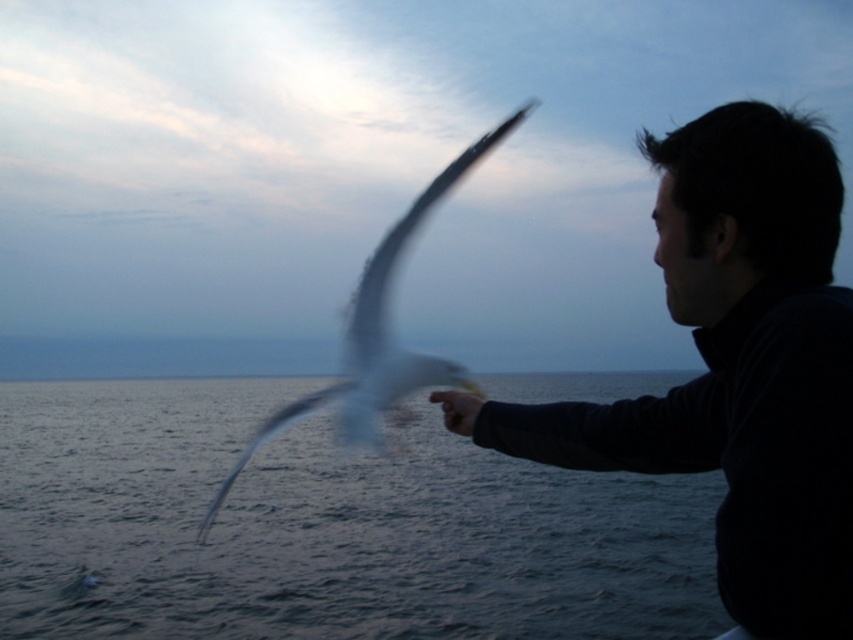
Consider the image. You are an observer standing on the dock looking at the black matte fish at right and the white feathered bird at center. Which object is positioned more to the right side of the scene?

The white feathered bird at center is positioned more to the right side of the scene because the black matte fish at right is to the left of it.

You are navigating a small boat in the twilight scene and need to drop an anchor. The coordinates for two potential anchor points are given as point (160,532) and point (379,433). According to the image, which point is closer to the person depicted in the scene?

Point (379,433) is closer to the person because point (160,532) is behind point (379,433), indicating it is farther away from the observer.

You are standing on a boat and see the clear water at lower left and the white feathered bird at center. Which object is closer to the water surface?

The clear water at lower left is located below the white feathered bird at center, so the clear water at lower left is closer to the water surface.